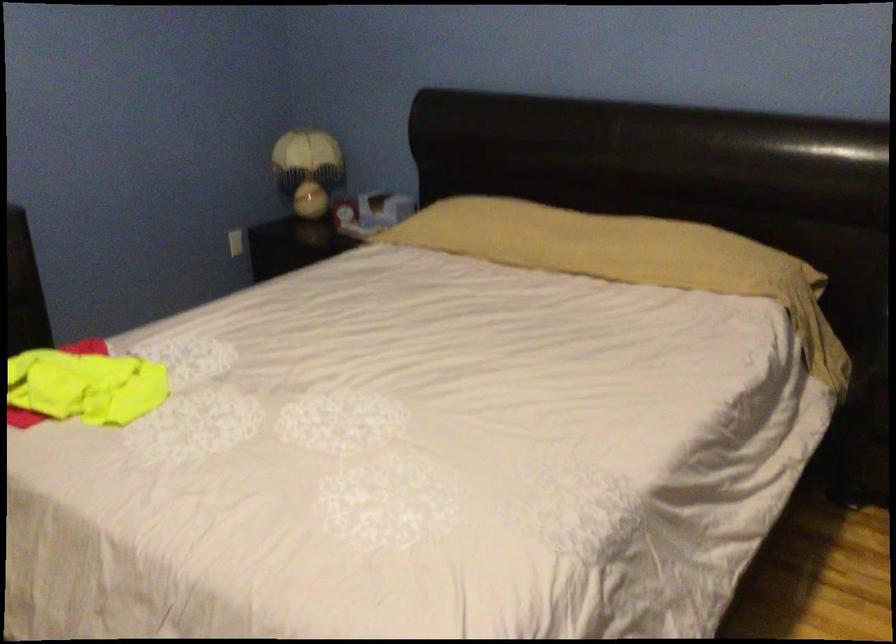
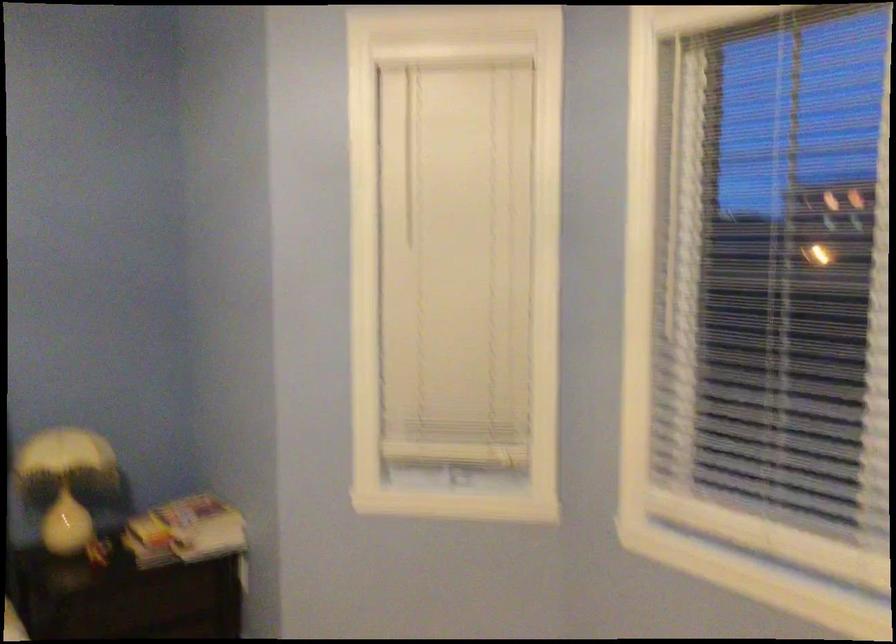
Question: How did the camera likely rotate?

Choices:
 (A) Left
 (B) Right
 (C) Up
 (D) Down

Answer: (B)